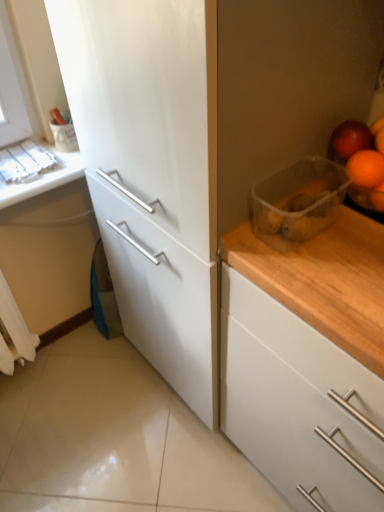
Question: From a real-world perspective, is transparent plastic container at upper right over white matte counter top at upper left?

Choices:
 (A) yes
 (B) no

Answer: (A)

Question: Considering the relative sizes of transparent plastic container at upper right and white matte counter top at upper left in the image provided, is transparent plastic container at upper right taller than white matte counter top at upper left?

Choices:
 (A) yes
 (B) no

Answer: (A)

Question: Does transparent plastic container at upper right have a greater width compared to white matte counter top at upper left?

Choices:
 (A) no
 (B) yes

Answer: (A)

Question: Can you confirm if transparent plastic container at upper right is bigger than white matte counter top at upper left?

Choices:
 (A) yes
 (B) no

Answer: (A)

Question: Does transparent plastic container at upper right have a lesser height compared to white matte counter top at upper left?

Choices:
 (A) yes
 (B) no

Answer: (B)

Question: Is transparent plastic container at upper right smaller than white matte counter top at upper left?

Choices:
 (A) yes
 (B) no

Answer: (B)

Question: Is white matte counter top at upper left further to the viewer compared to wooden countertop at right?

Choices:
 (A) no
 (B) yes

Answer: (B)

Question: From the image's perspective, is white matte counter top at upper left over wooden countertop at right?

Choices:
 (A) yes
 (B) no

Answer: (A)

Question: Does white matte counter top at upper left have a larger size compared to wooden countertop at right?

Choices:
 (A) no
 (B) yes

Answer: (A)

Question: Considering the relative sizes of white matte counter top at upper left and wooden countertop at right in the image provided, is white matte counter top at upper left taller than wooden countertop at right?

Choices:
 (A) no
 (B) yes

Answer: (A)

Question: Would you say white matte counter top at upper left contains wooden countertop at right?

Choices:
 (A) yes
 (B) no

Answer: (B)

Question: Is white matte counter top at upper left in front of wooden countertop at right?

Choices:
 (A) yes
 (B) no

Answer: (B)

Question: Does wooden countertop at right come behind white matte counter top at upper left?

Choices:
 (A) no
 (B) yes

Answer: (A)